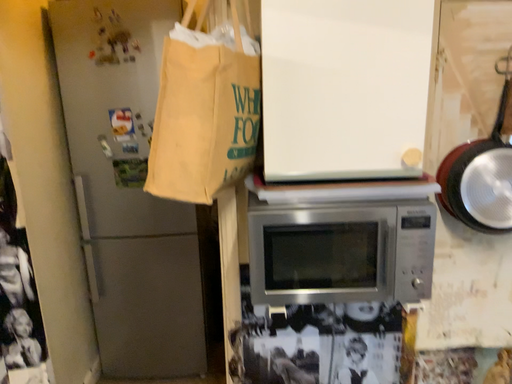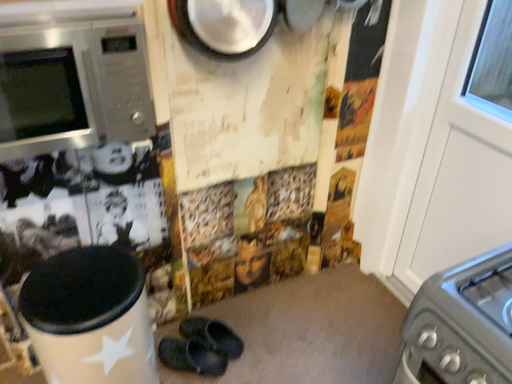
Question: Which way did the camera rotate in the video?

Choices:
 (A) rotated upward
 (B) rotated downward

Answer: (B)